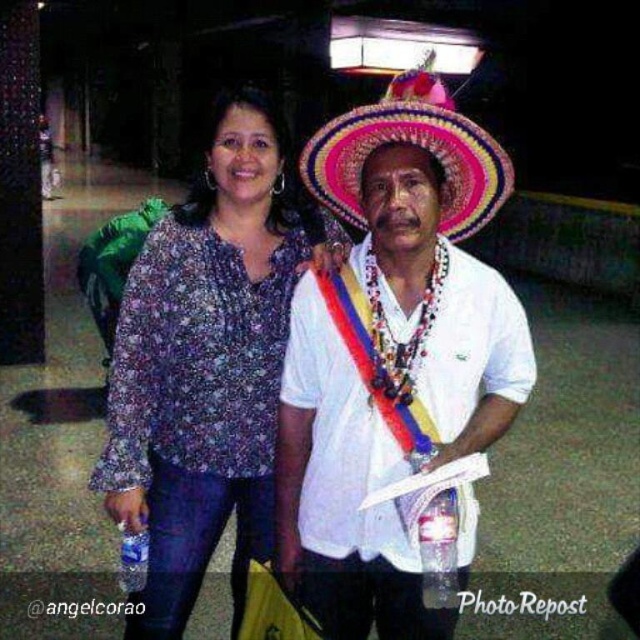
You are a tailor who needs to determine which item requires more fabric to make between the printed fabric blouse at center and the brightly colored woven hat at center. Which one would need more fabric?

The printed fabric blouse at center requires more fabric to make than the brightly colored woven hat at center because it is bigger.

You are organizing a cultural festival and need to place two items on a small display table. The items are the white woven hat at center and the printed fabric blouse at center. Based on their sizes, which item should you place first to ensure both fit on the table?

The white woven hat at center occupies less space than the printed fabric blouse at center, so you should place the printed fabric blouse at center first to ensure there is enough space for both items.

You are a photographer trying to capture a photo of both the printed fabric blouse at center and the brightly colored woven hat at center. Since you want them both in focus, you need to know which is closer to you. Can you determine which object is nearer based on their positions?

The printed fabric blouse at center is to the left of brightly colored woven hat at center, so the printed fabric blouse at center is closer to you because objects on the left in the image are typically closer in such compositions.